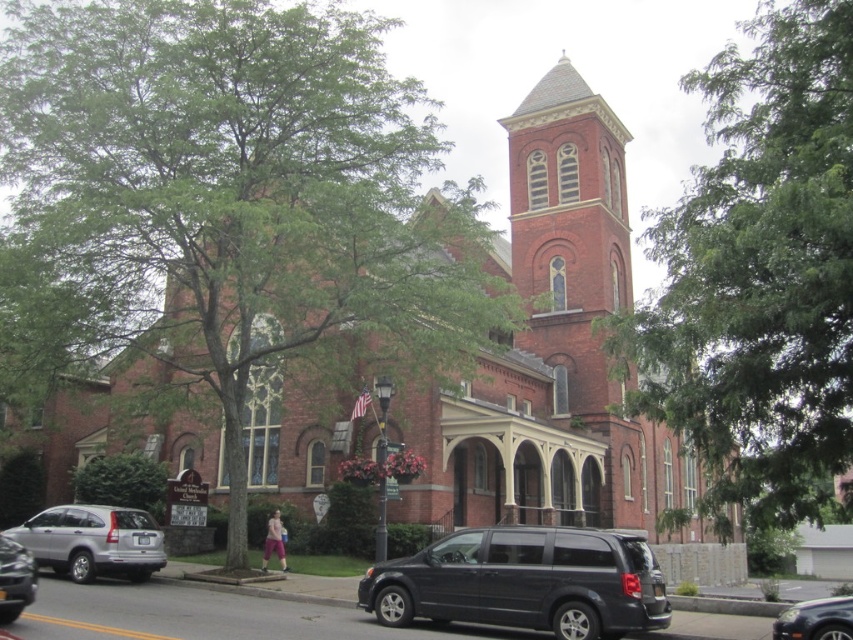
Is green leafy tree at left to the right of green leafy tree at upper right from the viewer's perspective?

In fact, green leafy tree at left is to the left of green leafy tree at upper right.

Who is more distant from viewer, [233,499] or [795,102]?

Point [233,499]

Where is `green leafy tree at left`? green leafy tree at left is located at coordinates (227, 204).

Find the location of a particular element. green leafy tree at left is located at coordinates (227, 204).

From the picture: Is green leafy tree at left to the right of matte black van at lower center from the viewer's perspective?

Incorrect, green leafy tree at left is not on the right side of matte black van at lower center.

Can you confirm if green leafy tree at left is wider than matte black van at lower center?

Correct, the width of green leafy tree at left exceeds that of matte black van at lower center.

Who is more forward, (41,154) or (434,604)?

Positioned in front is point (434,604).

In order to click on green leafy tree at left in this screenshot , I will do `click(227, 204)`.

Is matte black van at lower center positioned before satin silver suv at lower left?

Yes, matte black van at lower center is closer to the viewer.

Is matte black van at lower center taller than satin silver suv at lower left?

Indeed, matte black van at lower center has a greater height compared to satin silver suv at lower left.

Describe the element at coordinates (524, 580) in the screenshot. I see `matte black van at lower center` at that location.

Where is `matte black van at lower center`? The image size is (853, 640). matte black van at lower center is located at coordinates (524, 580).